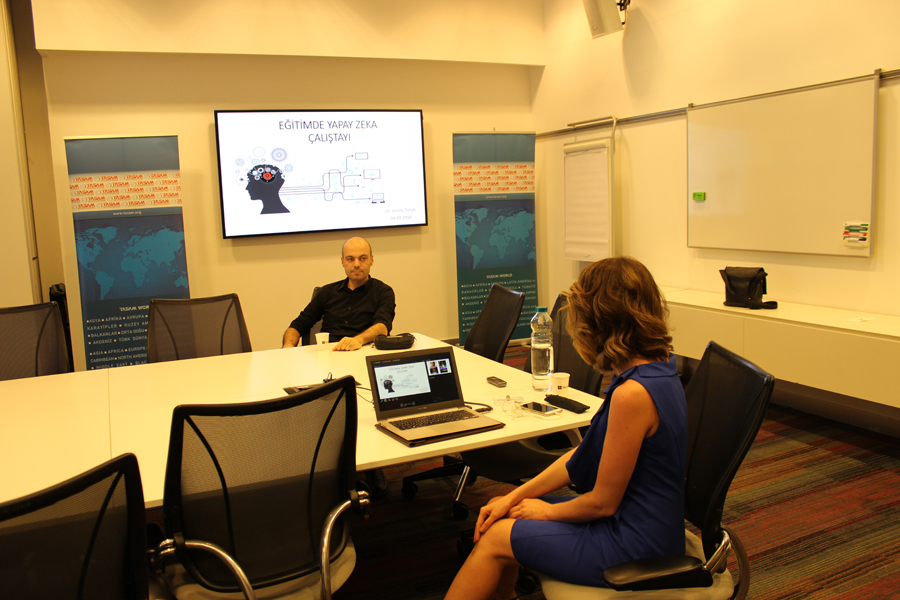
The width and height of the screenshot is (900, 600). Find the location of `8 chairs`. 8 chairs is located at coordinates (751, 440), (256, 489), (39, 567), (487, 318), (183, 336), (318, 301).